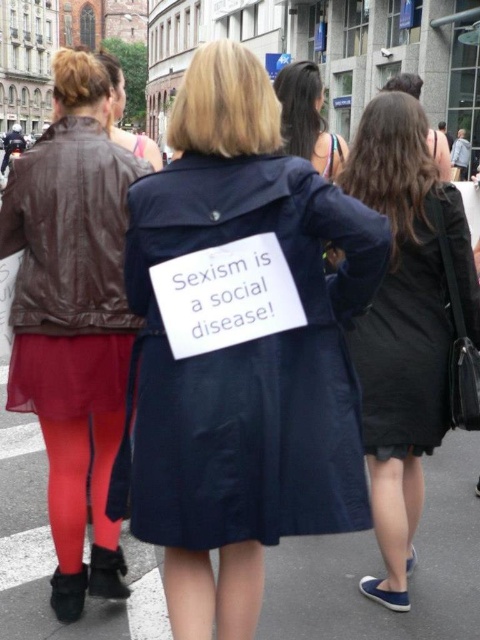
You are standing at the origin point of the image. Where is the navy blue coat at center located in terms of coordinates?

The navy blue coat at center is located at coordinates point (240,348).

You are standing at the origin point of the image coordinate system. Which of the two points, point [211,316] or point [116,122], is closer to you?

Point [211,316] is closer to the viewer than point [116,122].